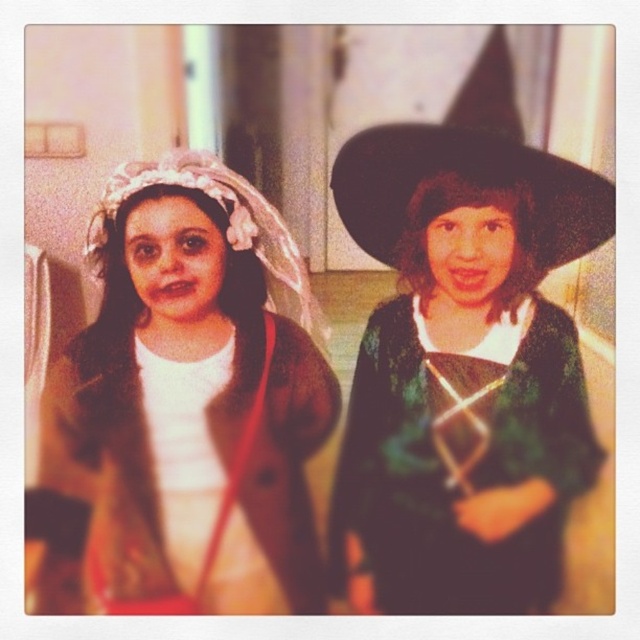
Question: Does green velvet dress at right have a greater width compared to black felt witch hat at upper right?

Choices:
 (A) no
 (B) yes

Answer: (B)

Question: Which point is closer to the camera taking this photo?

Choices:
 (A) (481, 113)
 (B) (211, 476)
 (C) (444, 472)

Answer: (B)

Question: Does matte brown coat at center have a greater width compared to green velvet dress at right?

Choices:
 (A) no
 (B) yes

Answer: (A)

Question: Which point is farther to the camera?

Choices:
 (A) green velvet dress at right
 (B) black felt witch hat at upper right

Answer: (B)

Question: Does matte brown coat at center appear on the left side of black felt witch hat at upper right?

Choices:
 (A) no
 (B) yes

Answer: (B)

Question: Which of the following is the closest to the observer?

Choices:
 (A) (349, 234)
 (B) (364, 396)

Answer: (B)